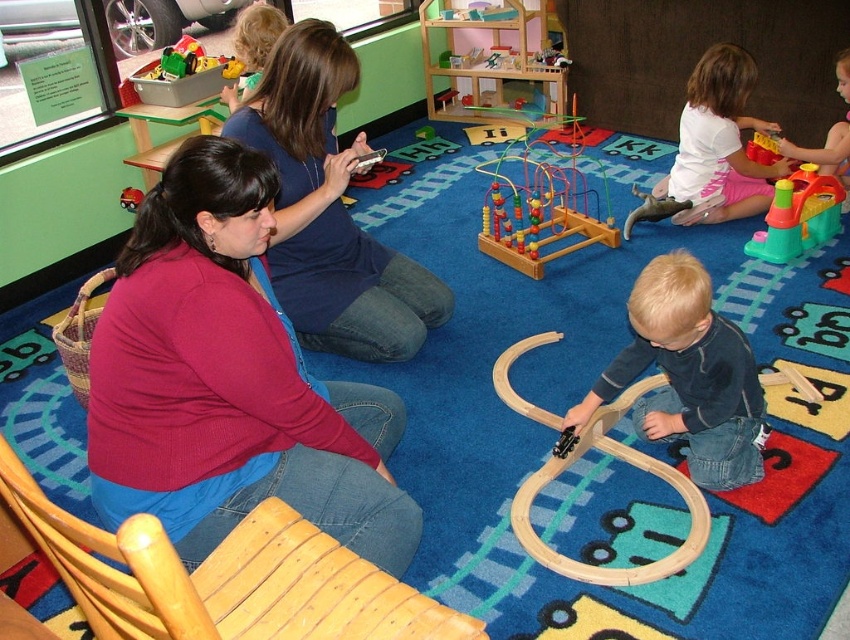
Question: Can you confirm if wooden dollhouse at center is positioned below white matte toy at upper right?

Choices:
 (A) no
 (B) yes

Answer: (A)

Question: Is blue denim jeans at center behind green plastic train at upper left?

Choices:
 (A) no
 (B) yes

Answer: (A)

Question: Which point is closer to the camera taking this photo?

Choices:
 (A) (440, 84)
 (B) (207, 177)

Answer: (B)

Question: Does white matte toy at upper right have a greater width compared to wooden bead maze at center?

Choices:
 (A) yes
 (B) no

Answer: (A)

Question: Among these objects, which one is nearest to the camera?

Choices:
 (A) matte pink sweater at lower left
 (B) wooden train track at center
 (C) smooth plastic toy at upper right

Answer: (A)

Question: Among these points, which one is nearest to the camera?

Choices:
 (A) (769, 234)
 (B) (819, 150)

Answer: (A)